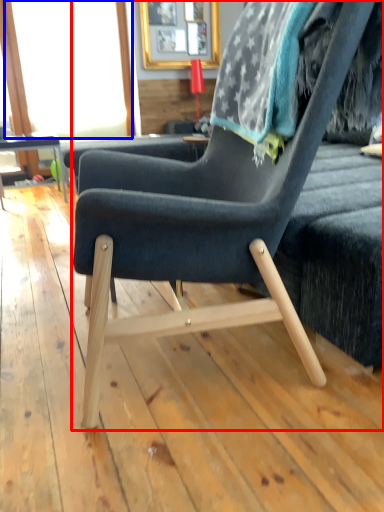
Question: Which object appears farthest to the camera in this image, chair (highlighted by a red box) or window screen (highlighted by a blue box)?

Choices:
 (A) chair
 (B) window screen

Answer: (B)